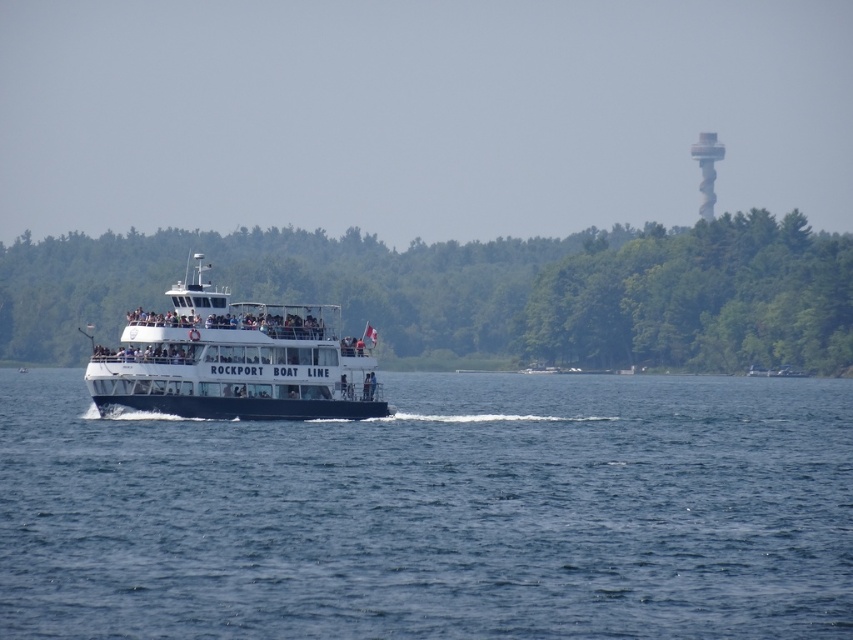
Does blue water at center appear on the left side of green leafy trees at center?

Incorrect, blue water at center is not on the left side of green leafy trees at center.

What do you see at coordinates (434, 513) in the screenshot?
I see `blue water at center` at bounding box center [434, 513].

You are a GUI agent. You are given a task and a screenshot of the screen. Output one action in this format:
    pyautogui.click(x=<x>, y=<y>)
    Task: Click on the blue water at center
    This screenshot has height=640, width=853.
    Given the screenshot: What is the action you would take?
    pyautogui.click(x=434, y=513)

The height and width of the screenshot is (640, 853). Describe the element at coordinates (434, 513) in the screenshot. I see `blue water at center` at that location.

At what (x,y) coordinates should I click in order to perform the action: click on blue water at center. Please return your answer as a coordinate pair (x, y). The height and width of the screenshot is (640, 853). Looking at the image, I should click on coord(434,513).

You are a GUI agent. You are given a task and a screenshot of the screen. Output one action in this format:
    pyautogui.click(x=<x>, y=<y>)
    Task: Click on the blue water at center
    
    Given the screenshot: What is the action you would take?
    pyautogui.click(x=434, y=513)

Locate an element on the screen. The height and width of the screenshot is (640, 853). blue water at center is located at coordinates (434, 513).

Can you confirm if blue water at center is positioned above white spiral tower at upper right?

Actually, blue water at center is below white spiral tower at upper right.

Can you confirm if blue water at center is shorter than white spiral tower at upper right?

Yes.

Is point (703, 611) farther from viewer compared to point (704, 198)?

That is False.

Where is `blue water at center`? blue water at center is located at coordinates (434, 513).